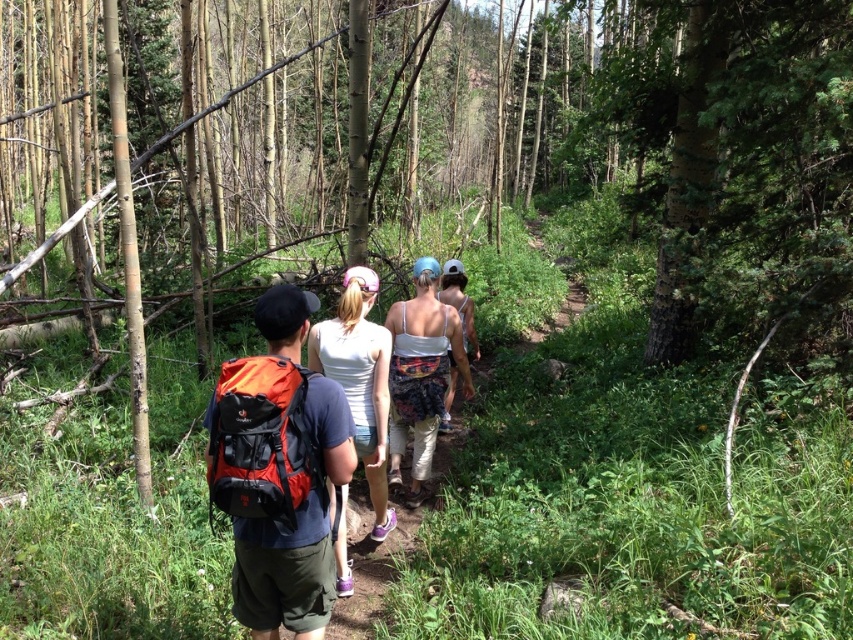
Does white fabric tank top at center appear under white floral dress at center?

Indeed, white fabric tank top at center is positioned under white floral dress at center.

Between point (364, 440) and point (439, 298), which one is positioned behind?

Positioned behind is point (439, 298).

Locate an element on the screen. white fabric tank top at center is located at coordinates (360, 380).

How much distance is there between floral fabric tank top at center and white floral dress at center?

floral fabric tank top at center and white floral dress at center are 14.97 inches apart from each other.

Does point (413, 460) lie behind point (471, 340)?

No, it is not.

Is point (398, 452) more distant than point (444, 275)?

That is False.

You are a GUI agent. You are given a task and a screenshot of the screen. Output one action in this format:
    pyautogui.click(x=<x>, y=<y>)
    Task: Click on the floral fabric tank top at center
    Image resolution: width=853 pixels, height=640 pixels.
    Given the screenshot: What is the action you would take?
    pyautogui.click(x=421, y=372)

Is orange fabric backpack at center taller than white floral dress at center?

In fact, orange fabric backpack at center may be shorter than white floral dress at center.

This screenshot has width=853, height=640. Describe the element at coordinates (287, 477) in the screenshot. I see `orange fabric backpack at center` at that location.

Where is `orange fabric backpack at center`? The image size is (853, 640). orange fabric backpack at center is located at coordinates (287, 477).